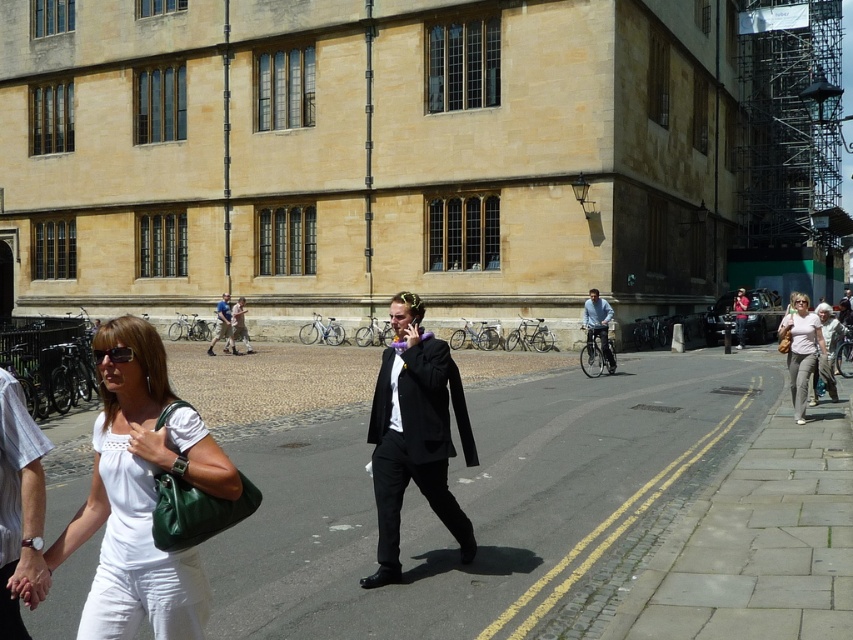
You are a photographer standing in front of the historic building. You see two people in the scene, one wearing a white cotton shirt at lower left and another wearing a light blue shirt at center. Which person do you think has a narrower torso based on their clothing?

The white cotton shirt at lower left is thinner than the light blue shirt at center, so the person wearing the white cotton shirt at lower left likely has a narrower torso.

You are standing on the street and see both the black matte suit at center and the white cotton shirt at lower left. Which one is positioned to the right side from your perspective?

The black matte suit at center is positioned to the right of the white cotton shirt at lower left.

You are standing at the point closest to the camera in this street scene. There are two points marked in the image, one at coordinates point [421,448] and another at point [9,442]. Which of these points is farther away from your current position?

Point [421,448] is behind point [9,442], so it is farther away from your current position.